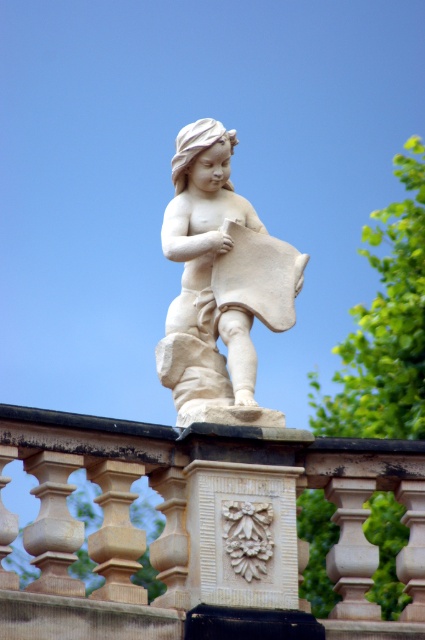
You are an architect designing a new garden and want to place both the white stone balustrade at center and the white marble statue at center in a small courtyard. Considering their sizes, which object would you place closer to the entrance to ensure there is enough space for visitors to walk around the larger one?

The white marble statue at center is larger than the white stone balustrade at center. To provide enough space for visitors to walk around the larger statue, you should place the smaller white stone balustrade at center closer to the entrance.

You are an art conservator examining the statue. You notice two points on the statue that need restoration. The first point is at coordinate point (169, 516) and the second is at point (220, 394). Which point should you address first if you want to start working from the closest to the furthest?

You should address the point (169, 516) first because it is closer to you than the point (220, 394).